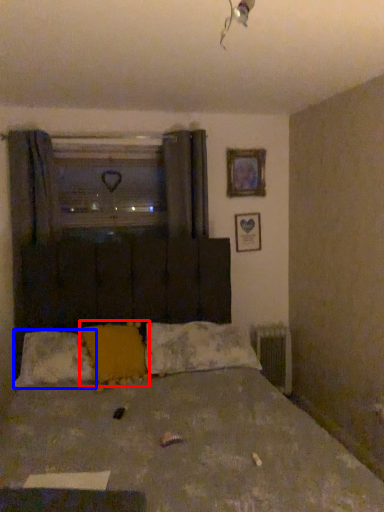
Question: Which of the following is the closest to the observer, pillow (highlighted by a red box) or pillow (highlighted by a blue box)?

Choices:
 (A) pillow
 (B) pillow

Answer: (A)